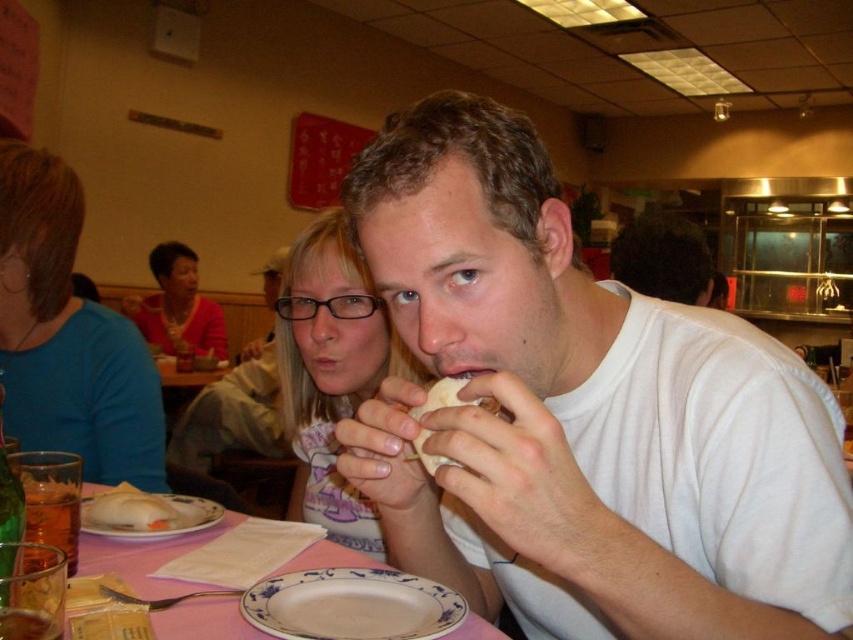
Question: Observing the image, what is the correct spatial positioning of porcelain plate at lower center in reference to white matte bread at lower left?

Choices:
 (A) above
 (B) below

Answer: (B)

Question: Based on their relative distances, which object is farther from the blue fabric shirt at left?

Choices:
 (A) white matte bread at lower left
 (B) white bread at center

Answer: (B)

Question: Which object is the farthest from the porcelain plate at lower center?

Choices:
 (A) blue fabric shirt at left
 (B) white matte bread at lower left
 (C) pink paper napkin at lower center
 (D) matte white shirt at center

Answer: (A)

Question: Which point is farther to the camera?

Choices:
 (A) matte pink sweater at upper left
 (B) blue fabric shirt at left
 (C) white matte plate at lower left

Answer: (A)

Question: Is matte white shirt at center positioned before matte pink sweater at upper left?

Choices:
 (A) yes
 (B) no

Answer: (A)

Question: Is pink paper napkin at lower center smaller than white matte plate at lower left?

Choices:
 (A) yes
 (B) no

Answer: (B)